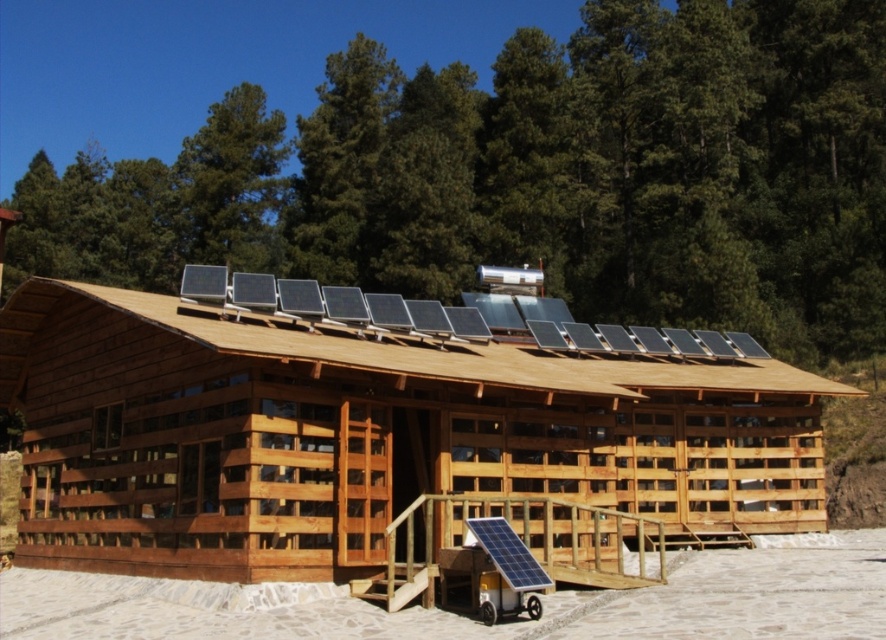
Question: Is natural wood hut at center to the left of wooden solar panels at center from the viewer's perspective?

Choices:
 (A) yes
 (B) no

Answer: (A)

Question: Which point appears closest to the camera in this image?

Choices:
 (A) (18, 349)
 (B) (193, 337)

Answer: (B)

Question: Among these points, which one is farthest from the camera?

Choices:
 (A) (457, 416)
 (B) (634, 387)

Answer: (B)

Question: Observing the image, what is the correct spatial positioning of natural wood hut at center in reference to wooden solar panels at center?

Choices:
 (A) left
 (B) right

Answer: (A)

Question: Does natural wood hut at center have a lesser width compared to wooden solar panels at center?

Choices:
 (A) yes
 (B) no

Answer: (A)